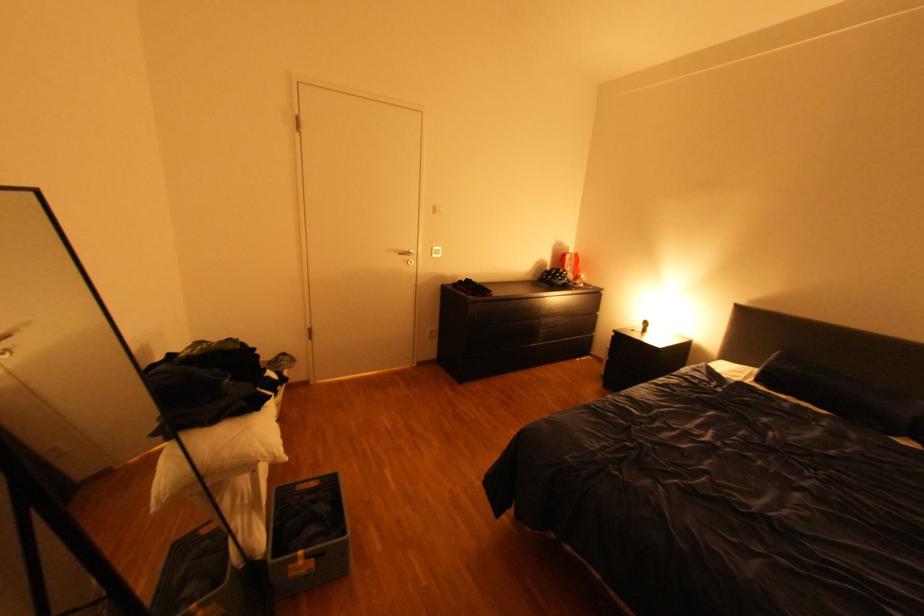
The location [307,535] corresponds to which object?

It corresponds to the red snack bag in the image.